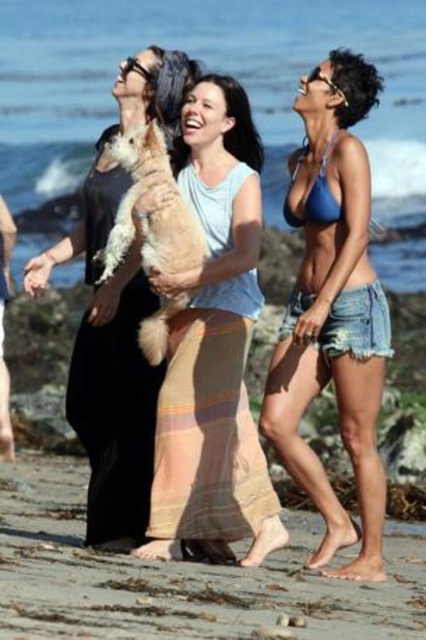
Consider the image. You are standing on the beach and see the smooth sand at lower center and the blue denim shorts at center. Which object is closer to your feet?

The smooth sand at lower center is located below the blue denim shorts at center, so it is closer to your feet.

What is the exact coordinate of the smooth sand at lower center?

The smooth sand at lower center is located at coordinate point (181, 577).